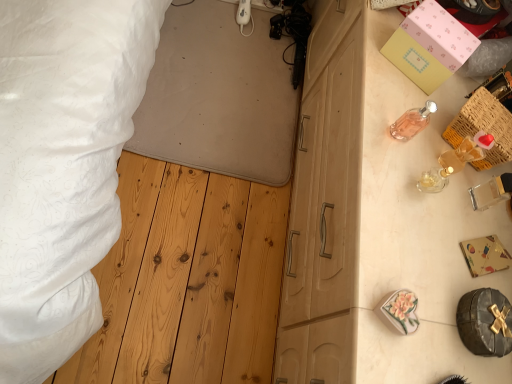
Locate an element on the screen. This screenshot has height=384, width=512. free space to the left of woven wood crate at upper right is located at coordinates (392, 105).